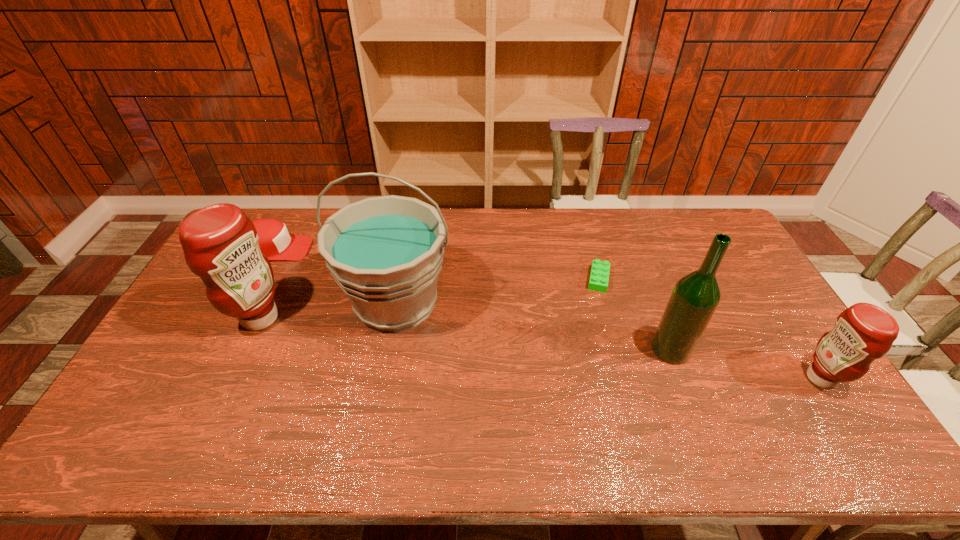
The image size is (960, 540). I want to click on object located in the far left corner section of the desktop, so click(274, 241).

Identify the location of object at the near right corner. Image resolution: width=960 pixels, height=540 pixels. (864, 332).

The height and width of the screenshot is (540, 960). I want to click on free space at the far edge of the desktop, so click(x=563, y=238).

Image resolution: width=960 pixels, height=540 pixels. Identify the location of vacant space at the near edge of the desktop. (746, 404).

Where is `vacant region at the right edge of the desktop`? Image resolution: width=960 pixels, height=540 pixels. vacant region at the right edge of the desktop is located at coordinates (760, 348).

Locate an element on the screen. vacant point at the far right corner is located at coordinates (692, 231).

Where is `free spot at the near right corner of the desktop`? This screenshot has width=960, height=540. free spot at the near right corner of the desktop is located at coordinates (806, 395).

Locate an element on the screen. free point between the farthest object and the rightmost object is located at coordinates click(x=548, y=314).

Find the location of a particular element. This screenshot has height=540, width=960. empty space that is in between the alcohol and the taller condiment is located at coordinates (466, 334).

Where is `vacant area that lies between the second object from right to left and the fourth tallest object`? vacant area that lies between the second object from right to left and the fourth tallest object is located at coordinates (746, 363).